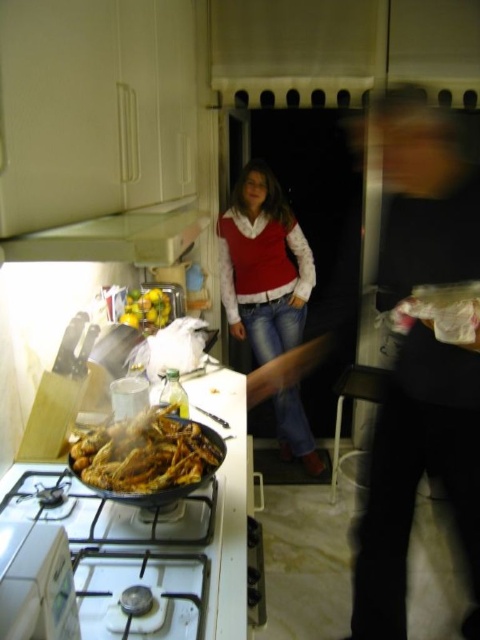
Does white glossy gas stove at lower left appear under golden crispy chicken at center?

Correct, white glossy gas stove at lower left is located below golden crispy chicken at center.

Between white glossy gas stove at lower left and golden crispy chicken at center, which one appears on the right side from the viewer's perspective?

golden crispy chicken at center is more to the right.

Identify the location of white glossy gas stove at lower left. click(152, 557).

Does white glossy gas stove at lower left have a lesser height compared to red knit sweater at center?

Indeed, white glossy gas stove at lower left has a lesser height compared to red knit sweater at center.

Who is positioned more to the right, white glossy gas stove at lower left or red knit sweater at center?

From the viewer's perspective, red knit sweater at center appears more on the right side.

Between point (132, 576) and point (240, 236), which one is positioned in front?

Point (132, 576) is in front.

You are a GUI agent. You are given a task and a screenshot of the screen. Output one action in this format:
    pyautogui.click(x=<x>, y=<y>)
    Task: Click on the white glossy gas stove at lower left
    The width and height of the screenshot is (480, 640).
    Given the screenshot: What is the action you would take?
    pyautogui.click(x=152, y=557)

Can you confirm if golden crispy chicken at center is positioned to the left of white matte exhaust hood at upper left?

In fact, golden crispy chicken at center is to the right of white matte exhaust hood at upper left.

Can you confirm if golden crispy chicken at center is positioned below white matte exhaust hood at upper left?

Indeed, golden crispy chicken at center is positioned under white matte exhaust hood at upper left.

What do you see at coordinates (146, 452) in the screenshot? I see `golden crispy chicken at center` at bounding box center [146, 452].

Identify the location of golden crispy chicken at center. (146, 452).